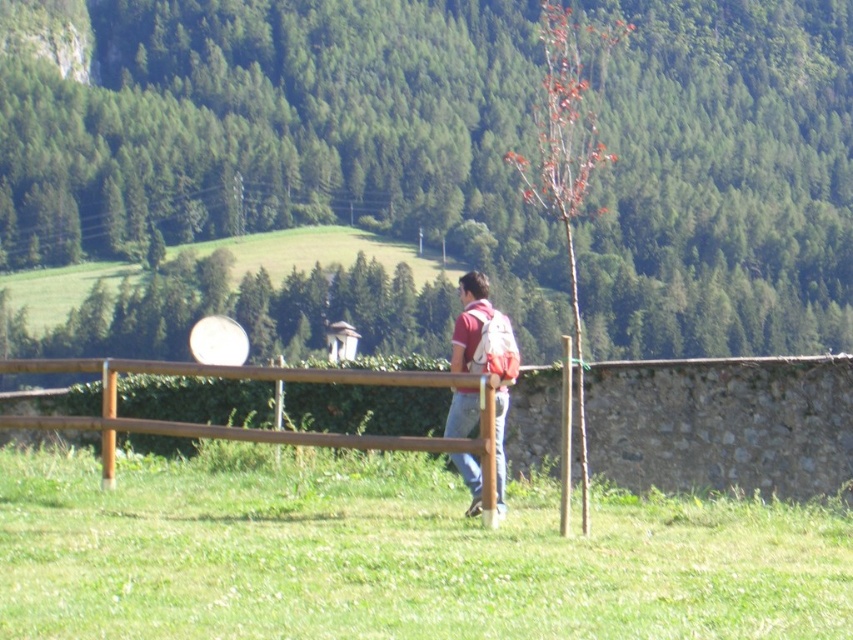
You are standing at the edge of the grassy area and want to take a photo of the green leafy tree at upper center and the brown wooden fence at center. Which object should you focus on first if you want both to be in sharp focus?

The brown wooden fence at center is closer to you than the green leafy tree at upper center, so you should focus on the brown wooden fence at center first to ensure both are in sharp focus.